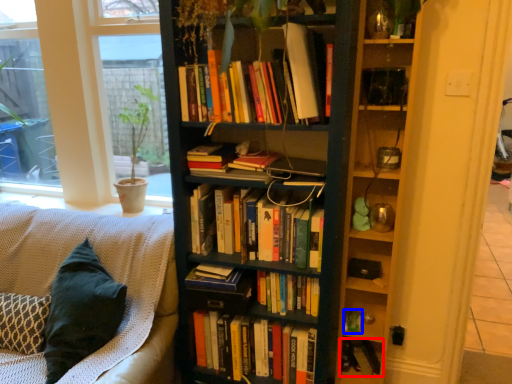
Question: Which of the following is the farthest to the observer, book (highlighted by a red box) or paperback book (highlighted by a blue box)?

Choices:
 (A) book
 (B) paperback book

Answer: (A)